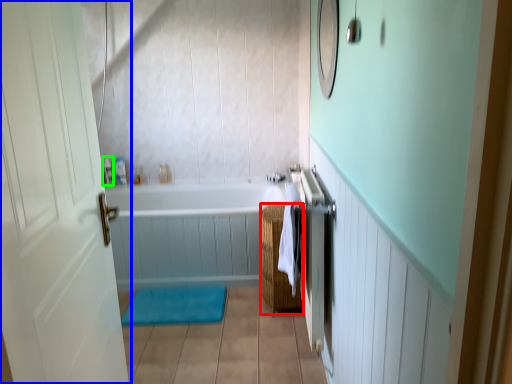
Question: Which object is positioned farthest from basket (highlighted by a red box)? Select from door (highlighted by a blue box) and toiletry (highlighted by a green box).

Choices:
 (A) door
 (B) toiletry

Answer: (B)